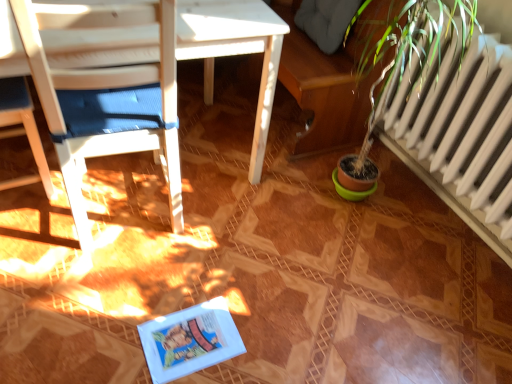
How much space does white wood chair at left, positioned as the second chair in left-to-right order, occupy vertically?

The height of white wood chair at left, positioned as the second chair in left-to-right order, is 92.33 centimeters.

In order to click on white wood chair at left, acting as the 1th chair starting from the right in this screenshot , I will do `click(106, 101)`.

The width and height of the screenshot is (512, 384). Describe the element at coordinates (106, 101) in the screenshot. I see `white wood chair at left, acting as the 1th chair starting from the right` at that location.

Measure the distance between white wood chair at left, which ranks as the first chair in left-to-right order, and camera.

A distance of 1.38 meters exists between white wood chair at left, which ranks as the first chair in left-to-right order, and camera.

What do you see at coordinates (22, 129) in the screenshot? Image resolution: width=512 pixels, height=384 pixels. I see `white wood chair at left, positioned as the 2th chair in right-to-left order` at bounding box center [22, 129].

This screenshot has height=384, width=512. In order to click on white wood chair at left, positioned as the 2th chair in right-to-left order in this screenshot , I will do `click(22, 129)`.

The image size is (512, 384). I want to click on white wood chair at left, acting as the 1th chair starting from the right, so click(x=106, y=101).

In the scene shown: Which object is positioned more to the right, white wood chair at left, which ranks as the first chair in left-to-right order, or white wood chair at left, positioned as the second chair in left-to-right order?

From the viewer's perspective, white wood chair at left, positioned as the second chair in left-to-right order, appears more on the right side.

Which object is closer to the camera, white wood chair at left, which ranks as the first chair in left-to-right order, or white wood chair at left, positioned as the second chair in left-to-right order?

white wood chair at left, positioned as the second chair in left-to-right order, is in front.

Does point (37, 165) appear closer or farther from the camera than point (161, 23)?

Point (37, 165).

From the image's perspective, is white wood chair at left, which ranks as the first chair in left-to-right order, over white wood chair at left, positioned as the second chair in left-to-right order?

Yes.

From a real-world perspective, who is located lower, white wood chair at left, which ranks as the first chair in left-to-right order, or white wood chair at left, acting as the 1th chair starting from the right?

white wood chair at left, which ranks as the first chair in left-to-right order.

Does white wood chair at left, which ranks as the first chair in left-to-right order, have a greater width compared to white wood chair at left, positioned as the second chair in left-to-right order?

No.

Is white wood chair at left, which ranks as the first chair in left-to-right order, shorter than white wood chair at left, positioned as the second chair in left-to-right order?

Yes, white wood chair at left, which ranks as the first chair in left-to-right order, is shorter than white wood chair at left, positioned as the second chair in left-to-right order.

Looking at the image, does white wood chair at left, positioned as the 2th chair in right-to-left order, seem bigger or smaller compared to white wood chair at left, acting as the 1th chair starting from the right?

Clearly, white wood chair at left, positioned as the 2th chair in right-to-left order, is smaller in size than white wood chair at left, acting as the 1th chair starting from the right.

Based on the photo, is white wood chair at left, positioned as the second chair in left-to-right order, completely or partially inside white wood chair at left, positioned as the 2th chair in right-to-left order?

No.

Is white wood chair at left, positioned as the 2th chair in right-to-left order, placed right next to white wood chair at left, positioned as the second chair in left-to-right order?

No, white wood chair at left, positioned as the 2th chair in right-to-left order, is not making contact with white wood chair at left, positioned as the second chair in left-to-right order.

Could you tell me if white wood chair at left, positioned as the 2th chair in right-to-left order, is turned towards white wood chair at left, acting as the 1th chair starting from the right?

No, white wood chair at left, positioned as the 2th chair in right-to-left order, is not facing towards white wood chair at left, acting as the 1th chair starting from the right.

How much distance is there between white wood chair at left, which ranks as the first chair in left-to-right order, and white wood chair at left, acting as the 1th chair starting from the right?

A distance of 14.84 inches exists between white wood chair at left, which ranks as the first chair in left-to-right order, and white wood chair at left, acting as the 1th chair starting from the right.

Image resolution: width=512 pixels, height=384 pixels. What are the coordinates of `chair that is above the white wood chair at left, positioned as the 2th chair in right-to-left order (from a real-world perspective)` in the screenshot? It's located at [x=106, y=101].

Between white wood chair at left, acting as the 1th chair starting from the right, and white wood chair at left, positioned as the 2th chair in right-to-left order, which one appears on the left side from the viewer's perspective?

white wood chair at left, positioned as the 2th chair in right-to-left order, is more to the left.

From the picture: Is white wood chair at left, positioned as the second chair in left-to-right order, closer to the viewer compared to white wood chair at left, which ranks as the first chair in left-to-right order?

Yes, white wood chair at left, positioned as the second chair in left-to-right order, is in front of white wood chair at left, which ranks as the first chair in left-to-right order.

Which is in front, point (106, 11) or point (27, 130)?

The point (106, 11) is in front.

From the image's perspective, is white wood chair at left, acting as the 1th chair starting from the right, under white wood chair at left, which ranks as the first chair in left-to-right order?

Yes, from the image's perspective, white wood chair at left, acting as the 1th chair starting from the right, is below white wood chair at left, which ranks as the first chair in left-to-right order.

From a real-world perspective, is white wood chair at left, acting as the 1th chair starting from the right, physically located above or below white wood chair at left, which ranks as the first chair in left-to-right order?

Clearly, from a real-world perspective, white wood chair at left, acting as the 1th chair starting from the right, is above white wood chair at left, which ranks as the first chair in left-to-right order.

Is white wood chair at left, positioned as the second chair in left-to-right order, wider or thinner than white wood chair at left, positioned as the 2th chair in right-to-left order?

Considering their sizes, white wood chair at left, positioned as the second chair in left-to-right order, looks broader than white wood chair at left, positioned as the 2th chair in right-to-left order.

Is white wood chair at left, acting as the 1th chair starting from the right, shorter than white wood chair at left, which ranks as the first chair in left-to-right order?

In fact, white wood chair at left, acting as the 1th chair starting from the right, may be taller than white wood chair at left, which ranks as the first chair in left-to-right order.

Considering the sizes of objects white wood chair at left, acting as the 1th chair starting from the right, and white wood chair at left, positioned as the 2th chair in right-to-left order, in the image provided, who is smaller, white wood chair at left, acting as the 1th chair starting from the right, or white wood chair at left, positioned as the 2th chair in right-to-left order,?

white wood chair at left, positioned as the 2th chair in right-to-left order, is smaller.

Would you say white wood chair at left, positioned as the second chair in left-to-right order, is outside white wood chair at left, positioned as the 2th chair in right-to-left order?

Yes, white wood chair at left, positioned as the second chair in left-to-right order, is not within white wood chair at left, positioned as the 2th chair in right-to-left order.

From the picture: Are white wood chair at left, positioned as the second chair in left-to-right order, and white wood chair at left, positioned as the 2th chair in right-to-left order, far apart?

Actually, white wood chair at left, positioned as the second chair in left-to-right order, and white wood chair at left, positioned as the 2th chair in right-to-left order, are a little close together.

Is white wood chair at left, acting as the 1th chair starting from the right, oriented towards white wood chair at left, which ranks as the first chair in left-to-right order?

No, white wood chair at left, acting as the 1th chair starting from the right, is not oriented towards white wood chair at left, which ranks as the first chair in left-to-right order.

How much distance is there between white wood chair at left, positioned as the second chair in left-to-right order, and white wood chair at left, positioned as the 2th chair in right-to-left order?

They are 37.70 centimeters apart.

Locate an element on the screen. This screenshot has width=512, height=384. chair that is below the white wood chair at left, positioned as the 2th chair in right-to-left order (from the image's perspective) is located at coordinates click(106, 101).

Image resolution: width=512 pixels, height=384 pixels. I want to click on chair above the white wood chair at left, positioned as the second chair in left-to-right order (from the image's perspective), so click(22, 129).

This screenshot has height=384, width=512. What are the coordinates of `chair located in front of the white wood chair at left, which ranks as the first chair in left-to-right order` in the screenshot? It's located at (106, 101).